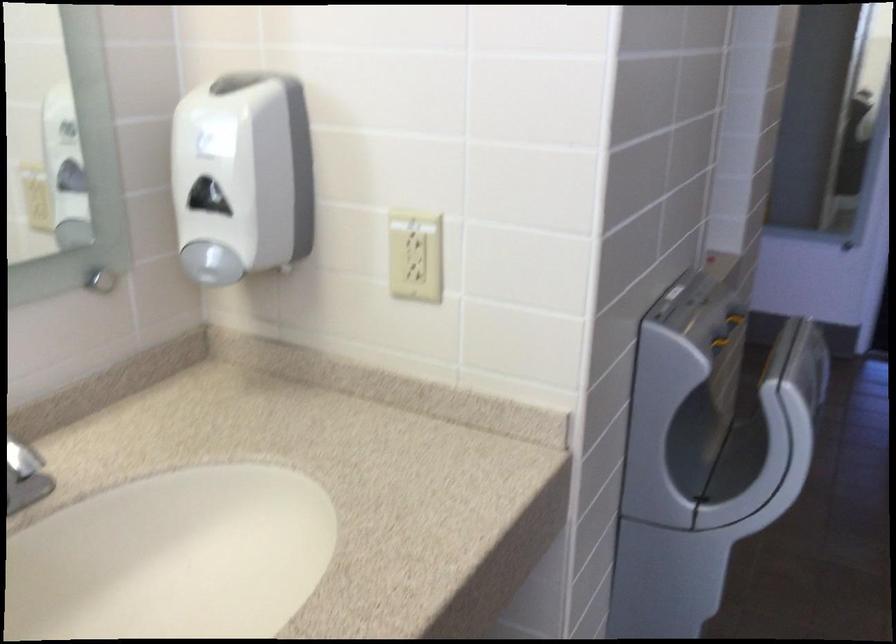
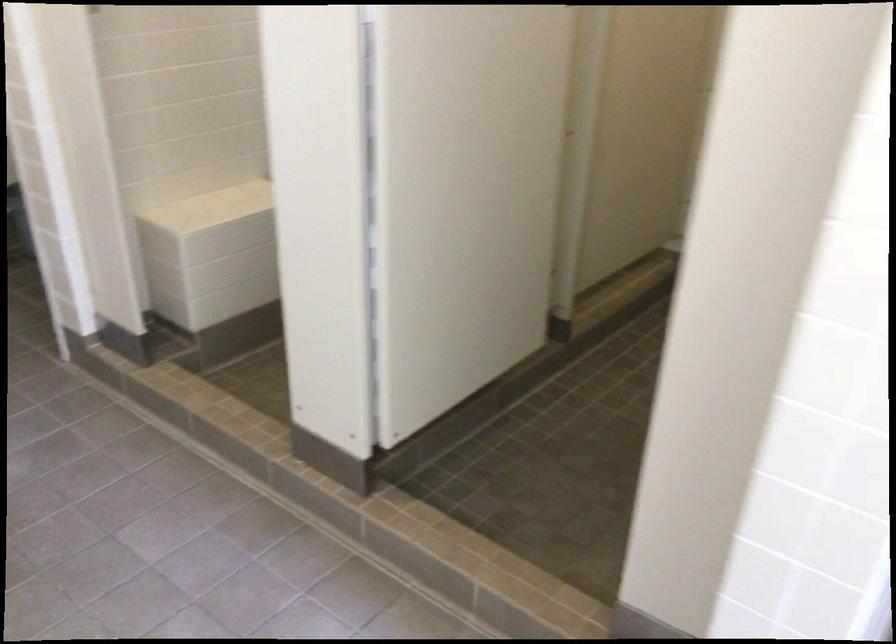
The first image is from the beginning of the video and the second image is from the end. How did the camera likely rotate when shooting the video?

The camera's rotation is toward right-down.